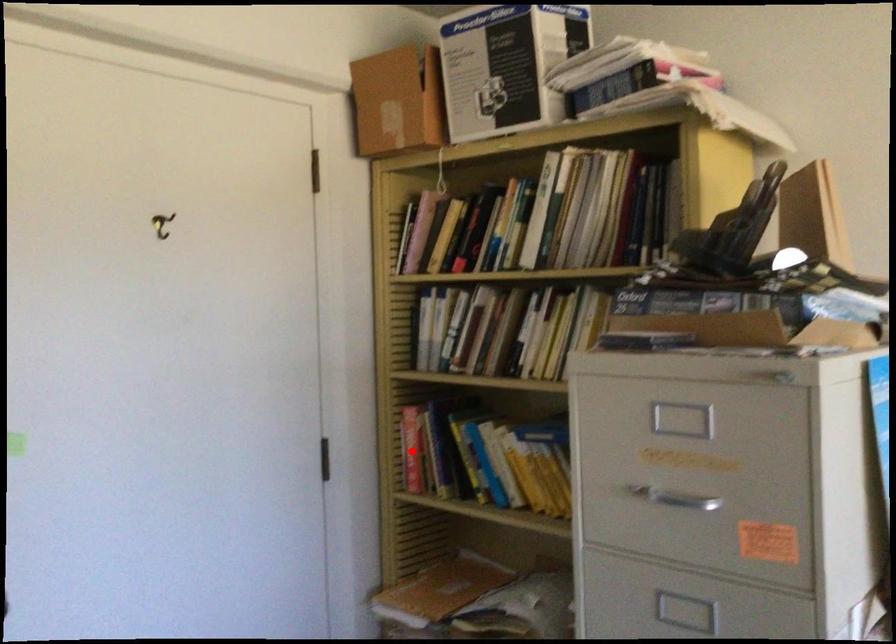
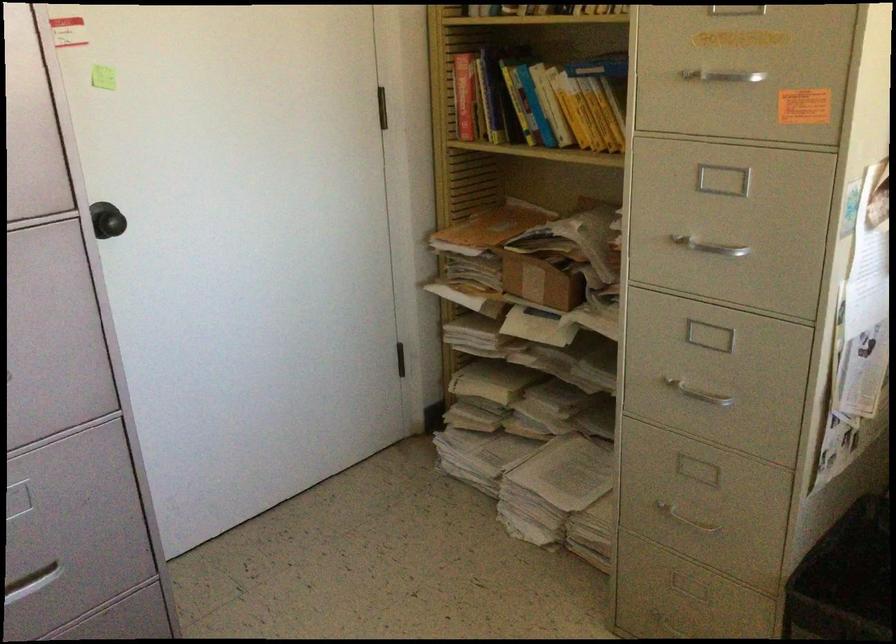
Locate, in the second image, the point that corresponds to the highlighted location in the first image.

(464, 96)